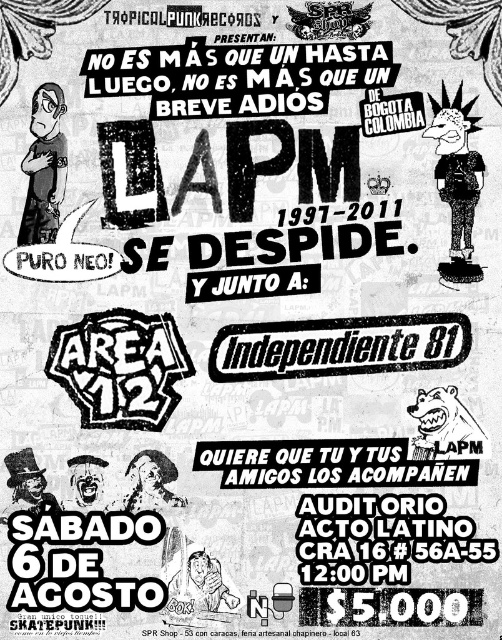
Who is shorter, black rubber logo at center or black textured sticker at center?

With less height is black textured sticker at center.

Who is more distant from viewer, (367, 356) or (102, 358)?

Point (102, 358)

Is point (389, 321) closer to viewer compared to point (151, 353)?

Yes, point (389, 321) is in front of point (151, 353).

Where is `black rubber logo at center`? The image size is (502, 640). black rubber logo at center is located at coordinates (338, 346).

Does black rubber logo at center have a greater width compared to matte black shirt at left?

Yes, black rubber logo at center is wider than matte black shirt at left.

Does black rubber logo at center come behind matte black shirt at left?

No, it is not.

Between point (242, 337) and point (37, 173), which one is positioned in front?

Point (242, 337) is more forward.

Image resolution: width=502 pixels, height=640 pixels. Find the location of `black rubber logo at center`. black rubber logo at center is located at coordinates click(338, 346).

Does black textured sticker at center appear on the left side of black textured shirt at upper right?

Indeed, black textured sticker at center is positioned on the left side of black textured shirt at upper right.

Who is taller, black textured sticker at center or black textured shirt at upper right?

black textured sticker at center is taller.

You are a GUI agent. You are given a task and a screenshot of the screen. Output one action in this format:
    pyautogui.click(x=<x>, y=<y>)
    Task: Click on the black textured sticker at center
    
    Given the screenshot: What is the action you would take?
    pyautogui.click(x=119, y=368)